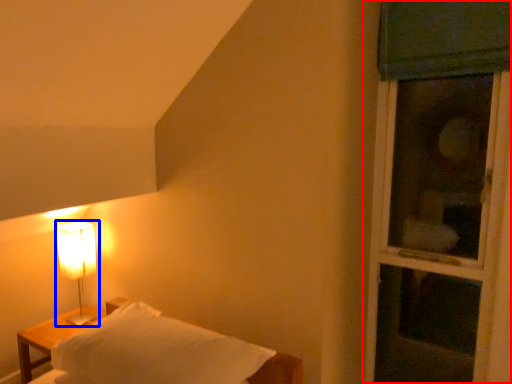
Question: Among these objects, which one is nearest to the camera, window (highlighted by a red box) or lamp (highlighted by a blue box)?

Choices:
 (A) window
 (B) lamp

Answer: (A)